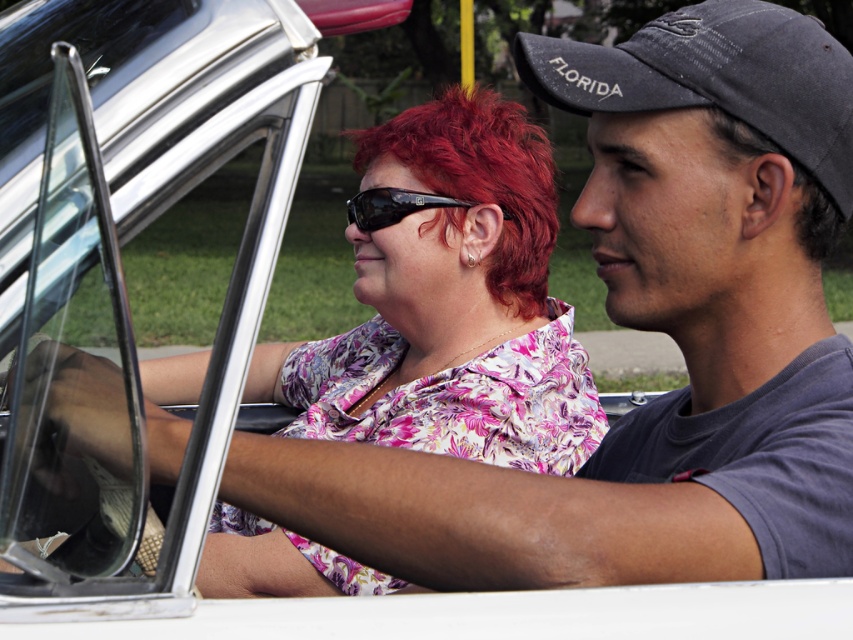
The width and height of the screenshot is (853, 640). What do you see at coordinates (717, 77) in the screenshot?
I see `black fabric baseball cap at upper right` at bounding box center [717, 77].

Is black fabric baseball cap at upper right thinner than dark brown curly hair at right?

No.

Between point (804, 104) and point (740, 154), which one is positioned in front?

Point (804, 104) is more forward.

The width and height of the screenshot is (853, 640). What are the coordinates of `black fabric baseball cap at upper right` in the screenshot? It's located at 717,77.

Is point (193, 566) more distant than point (418, 205)?

No, (193, 566) is in front of (418, 205).

Locate an element on the screen. clear glass window at center is located at coordinates (160, 218).

Does point (763, 8) come behind point (373, 198)?

No, it is in front of (373, 198).

Does black fabric baseball cap at upper right have a greater height compared to black reflective sunglasses at center?

Correct, black fabric baseball cap at upper right is much taller as black reflective sunglasses at center.

Between point (753, 128) and point (386, 224), which one is positioned behind?

The point (386, 224) is behind.

Identify the location of black fabric baseball cap at upper right. (717, 77).